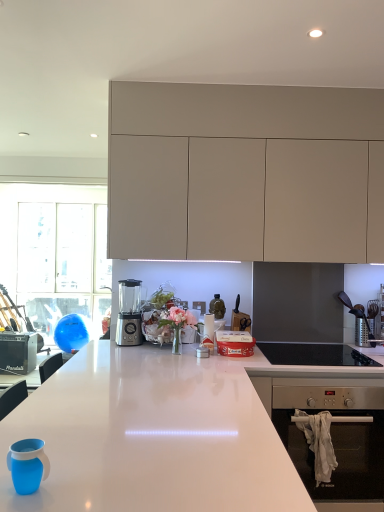
Question: Is matte beige cabinets at upper center turned away from teal silicone cup at lower left?

Choices:
 (A) no
 (B) yes

Answer: (A)

Question: Can you confirm if matte beige cabinets at upper center is shorter than teal silicone cup at lower left?

Choices:
 (A) no
 (B) yes

Answer: (A)

Question: Is matte beige cabinets at upper center behind teal silicone cup at lower left?

Choices:
 (A) yes
 (B) no

Answer: (A)

Question: Considering the relative sizes of matte beige cabinets at upper center and teal silicone cup at lower left in the image provided, is matte beige cabinets at upper center smaller than teal silicone cup at lower left?

Choices:
 (A) no
 (B) yes

Answer: (A)

Question: Could teal silicone cup at lower left be considered to be inside matte beige cabinets at upper center?

Choices:
 (A) no
 (B) yes

Answer: (A)

Question: Considering the positions of teal silicone cup at lower left and matte beige cabinets at upper center in the image, is teal silicone cup at lower left bigger or smaller than matte beige cabinets at upper center?

Choices:
 (A) big
 (B) small

Answer: (B)

Question: Looking at their shapes, would you say teal silicone cup at lower left is wider or thinner than matte beige cabinets at upper center?

Choices:
 (A) thin
 (B) wide

Answer: (A)

Question: From a real-world perspective, is teal silicone cup at lower left physically located above or below matte beige cabinets at upper center?

Choices:
 (A) above
 (B) below

Answer: (B)

Question: Is teal silicone cup at lower left in front of or behind matte beige cabinets at upper center in the image?

Choices:
 (A) behind
 (B) front

Answer: (B)

Question: Which is correct: teal silicone cup at lower left is inside white glossy countertop at center, or outside of it?

Choices:
 (A) outside
 (B) inside

Answer: (A)

Question: Is teal silicone cup at lower left to the left or to the right of white glossy countertop at center in the image?

Choices:
 (A) right
 (B) left

Answer: (B)

Question: Is teal silicone cup at lower left taller or shorter than white glossy countertop at center?

Choices:
 (A) tall
 (B) short

Answer: (B)

Question: From a real-world perspective, is teal silicone cup at lower left positioned above or below white glossy countertop at center?

Choices:
 (A) below
 (B) above

Answer: (B)

Question: From the image's perspective, is black glass cooktop at lower right above or below matte beige cabinets at upper center?

Choices:
 (A) above
 (B) below

Answer: (B)

Question: Which is correct: black glass cooktop at lower right is inside matte beige cabinets at upper center, or outside of it?

Choices:
 (A) outside
 (B) inside

Answer: (A)